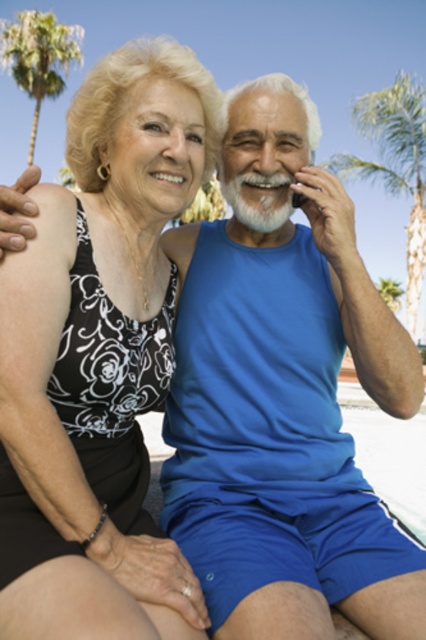
You are standing at the point labeled as point (178, 420) and want to take a photo of the two people sitting nearby. The camera you have can focus on subjects within 10 feet. Will the two people be in focus?

The distance between point (178, 420) and the viewer is 7.06 feet, which is within the camera focus range of 10 feet. Therefore, the two people will be in focus.

You are standing at the point with coordinates point (382, 120) and want to walk to the point with coordinates point (253, 323). Which direction should you move in?

You should move forward because point (253, 323) is in front of point (382, 120).